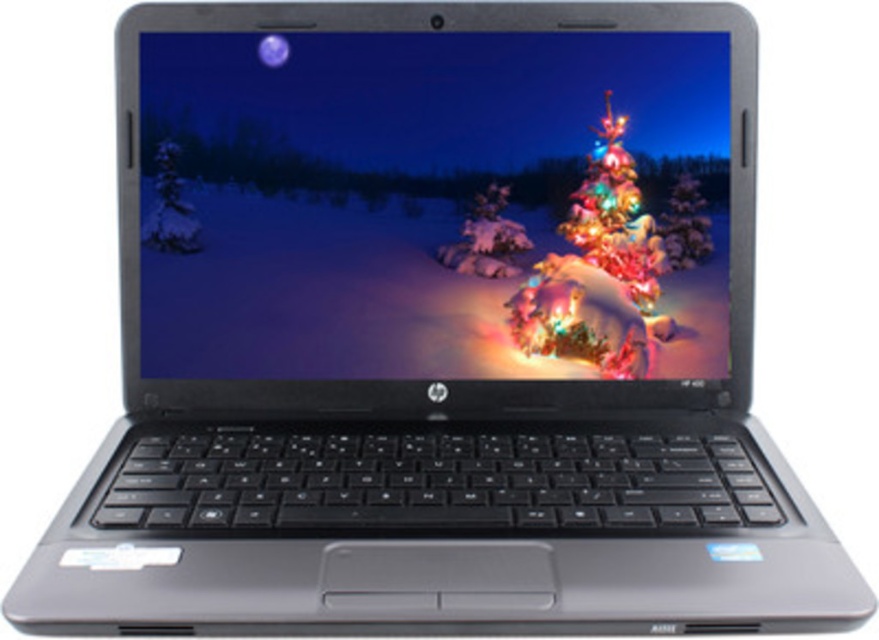
Looking at this image, you are looking at the laptop screen showing the snowy Christmas scene. There are two points marked on the screen at coordinates point (320,256) and point (614,170). If you were to touch the screen, which point would feel closer to your hand?

Point (320,256) is closer to the viewer than point (614,170), so touching that point would feel closer.

You are looking at the laptop screen. Which object is closer to your eyes, the matte plastic screen at center or the iridescent plastic christmas tree at center?

The matte plastic screen at center is closer to the viewer than the iridescent plastic christmas tree at center.

Based on the photo, you are holding a camera and want to take a clear photo of the matte plastic screen at center. The camera requires the subject to be at least 30 inches away to avoid blurring. Based on the scene description, will the current distance allow for a clear photo?

The matte plastic screen at center is currently 27.42 inches away from the camera, which is less than the required 30 inches. Therefore, the current distance will not allow for a clear photo without blurring.